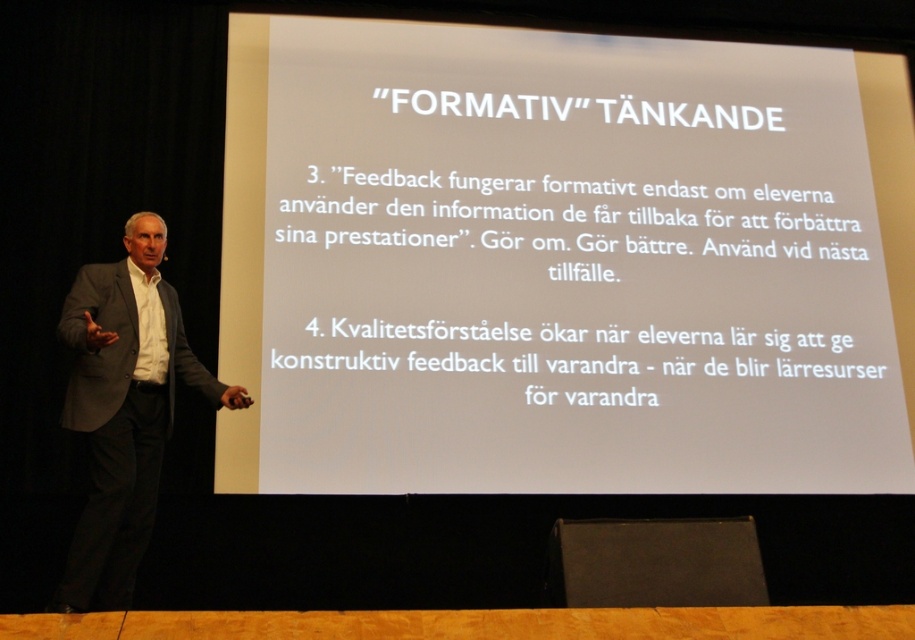
Question: Considering the relative positions of dark gray suit at left and black fabric speaker at lower center in the image provided, where is dark gray suit at left located with respect to black fabric speaker at lower center?

Choices:
 (A) above
 (B) below

Answer: (A)

Question: Which object appears farthest from the camera in this image?

Choices:
 (A) dark gray suit at left
 (B) white paper at upper center

Answer: (B)

Question: Among these objects, which one is farthest from the camera?

Choices:
 (A) black fabric speaker at lower center
 (B) white paper at upper center

Answer: (B)

Question: Is white paper at upper center closer to camera compared to black fabric speaker at lower center?

Choices:
 (A) yes
 (B) no

Answer: (B)

Question: Can you confirm if white paper at upper center is positioned above black fabric speaker at lower center?

Choices:
 (A) no
 (B) yes

Answer: (B)

Question: Which object is positioned closest to the black fabric speaker at lower center?

Choices:
 (A) dark gray suit at left
 (B) white paper at upper center

Answer: (A)